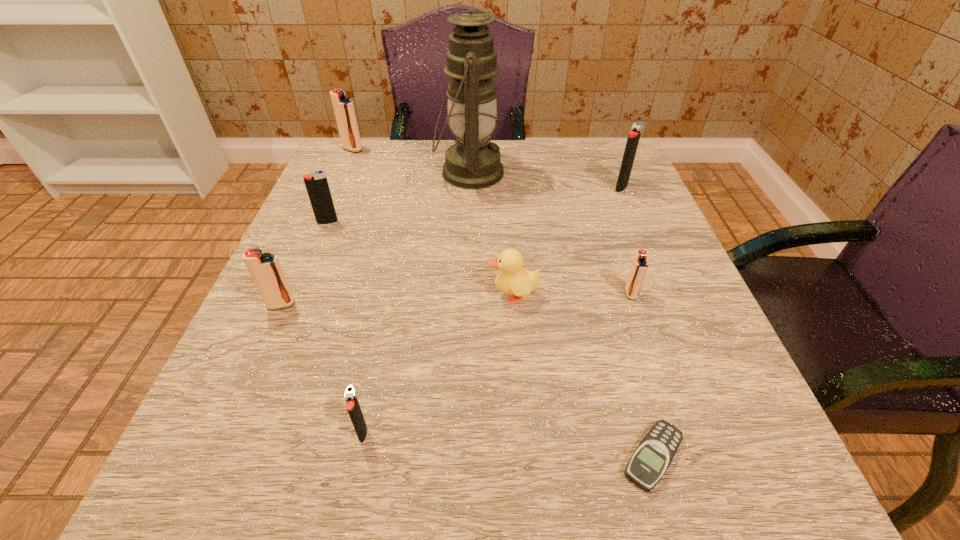
At what (x,y) coordinates should I click in order to perform the action: click on free space located 0.270m on the front-facing side of the yellow duckling. Please return your answer as a coordinate pair (x, y). The height and width of the screenshot is (540, 960). Looking at the image, I should click on (328, 295).

This screenshot has width=960, height=540. I want to click on free location located on the front-facing side of the yellow duckling, so click(370, 295).

At what (x,y) coordinates should I click in order to perform the action: click on vacant point located on the front-facing side of the yellow duckling. Please return your answer as a coordinate pair (x, y). Looking at the image, I should click on (405, 295).

Image resolution: width=960 pixels, height=540 pixels. I want to click on vacant area located 0.330m on the front of the rightmost red igniter, so click(705, 512).

Locate an element on the screen. This screenshot has height=540, width=960. vacant area situated on the back of the nearest black igniter is located at coordinates (375, 370).

Locate an element on the screen. free space located 0.210m on the left of the shortest object is located at coordinates (451, 457).

You are a GUI agent. You are given a task and a screenshot of the screen. Output one action in this format:
    pyautogui.click(x=<x>, y=<y>)
    Task: Click on the oil lamp that is at the far edge
    This screenshot has height=540, width=960.
    Given the screenshot: What is the action you would take?
    pyautogui.click(x=474, y=162)

The image size is (960, 540). I want to click on object that is at the near edge, so click(654, 454).

This screenshot has width=960, height=540. I want to click on beeper at the right edge, so click(654, 454).

You are a GUI agent. You are given a task and a screenshot of the screen. Output one action in this format:
    pyautogui.click(x=<x>, y=<y>)
    Task: Click on the object situated at the far left corner
    Image resolution: width=960 pixels, height=540 pixels.
    Given the screenshot: What is the action you would take?
    (x=343, y=107)